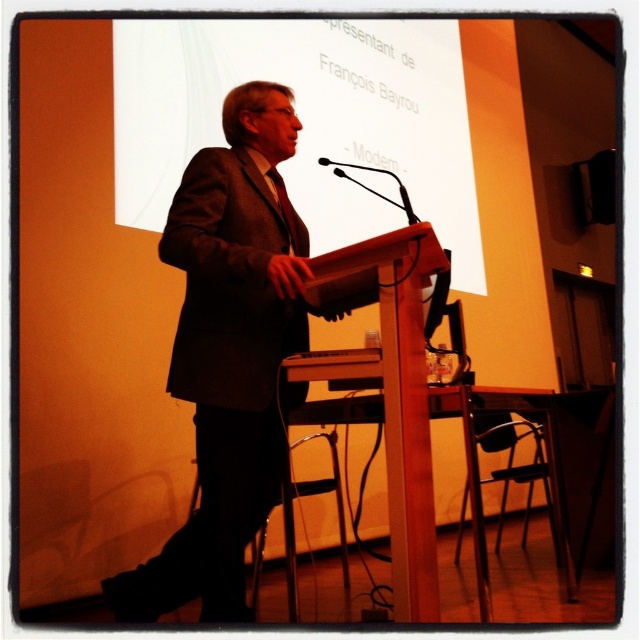
Question: Where is white paper at upper center located in relation to black matte microphone at center in the image?

Choices:
 (A) below
 (B) above

Answer: (B)

Question: Which of the following is the farthest from the observer?

Choices:
 (A) (269, 132)
 (B) (154, 90)
 (C) (348, 166)

Answer: (C)

Question: Can you confirm if dark brown suit at center is wider than black matte microphone at center?

Choices:
 (A) no
 (B) yes

Answer: (B)

Question: Which object is positioned farthest from the dark brown suit at center?

Choices:
 (A) white paper at upper center
 (B) black matte microphone at center

Answer: (A)

Question: Which point is closer to the camera?

Choices:
 (A) dark brown suit at center
 (B) white paper at upper center

Answer: (A)

Question: Can you confirm if white paper at upper center is positioned above dark brown suit at center?

Choices:
 (A) yes
 (B) no

Answer: (A)